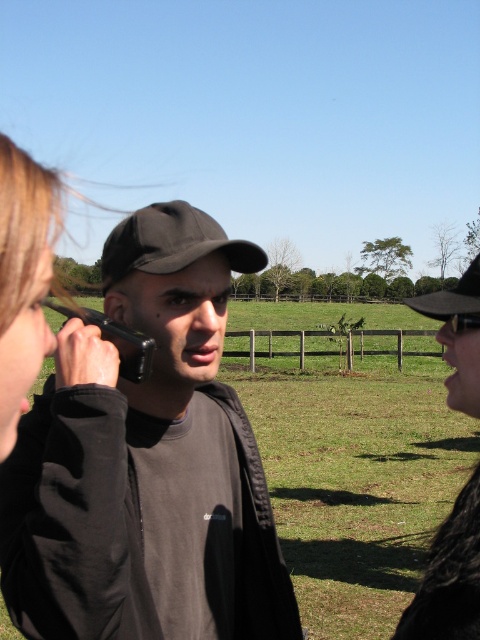
Between black textured hat at right and black matte smartphone at left, which one appears on the right side from the viewer's perspective?

black textured hat at right

Between point (462, 506) and point (148, 356), which one is positioned in front?

Point (462, 506)

Image resolution: width=480 pixels, height=640 pixels. What are the coordinates of `black textured hat at right` in the screenshot? It's located at (450, 577).

Does matte black cap at center have a larger size compared to black textured hat at right?

Indeed, matte black cap at center has a larger size compared to black textured hat at right.

Can you confirm if matte black cap at center is positioned above black textured hat at right?

Yes.

Is point (231, 596) closer to viewer compared to point (451, 525)?

That is False.

Where is `matte black cap at center`? matte black cap at center is located at coordinates (147, 467).

Is black textured hat at right smaller than black fabric baseball cap at center?

Correct, black textured hat at right occupies less space than black fabric baseball cap at center.

Can you confirm if black textured hat at right is wider than black fabric baseball cap at center?

Incorrect, black textured hat at right's width does not surpass black fabric baseball cap at center's.

Between point (465, 632) and point (175, 227), which one is positioned in front?

Positioned in front is point (465, 632).

Where is `black textured hat at right`? The image size is (480, 640). black textured hat at right is located at coordinates (450, 577).